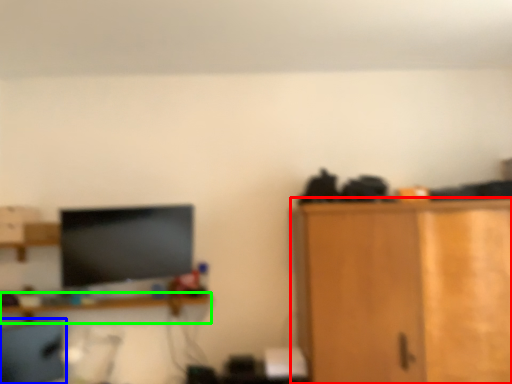
Question: Based on their relative distances, which object is farther from cabinetry (highlighted by a red box)? Choose from computer chair (highlighted by a blue box) and shelf (highlighted by a green box).

Choices:
 (A) computer chair
 (B) shelf

Answer: (A)